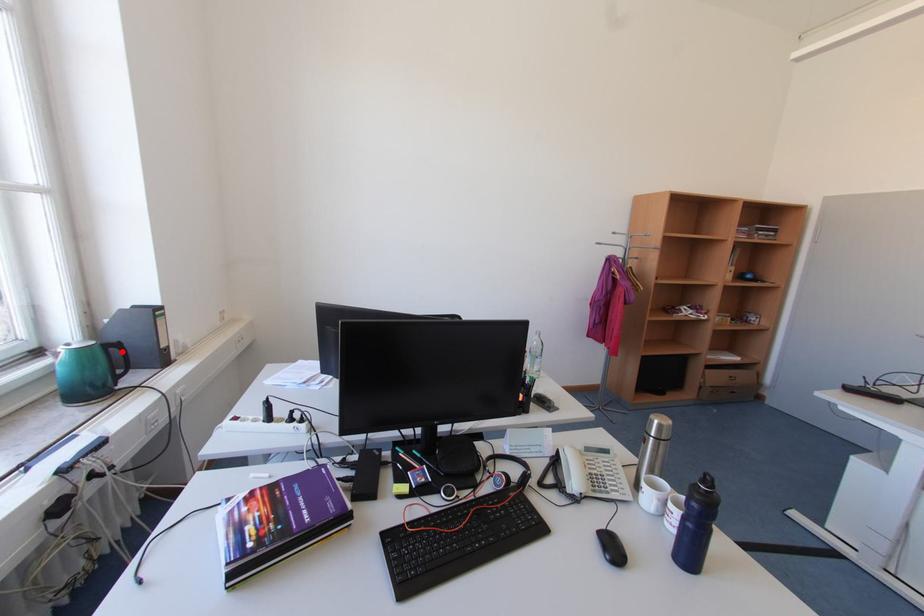
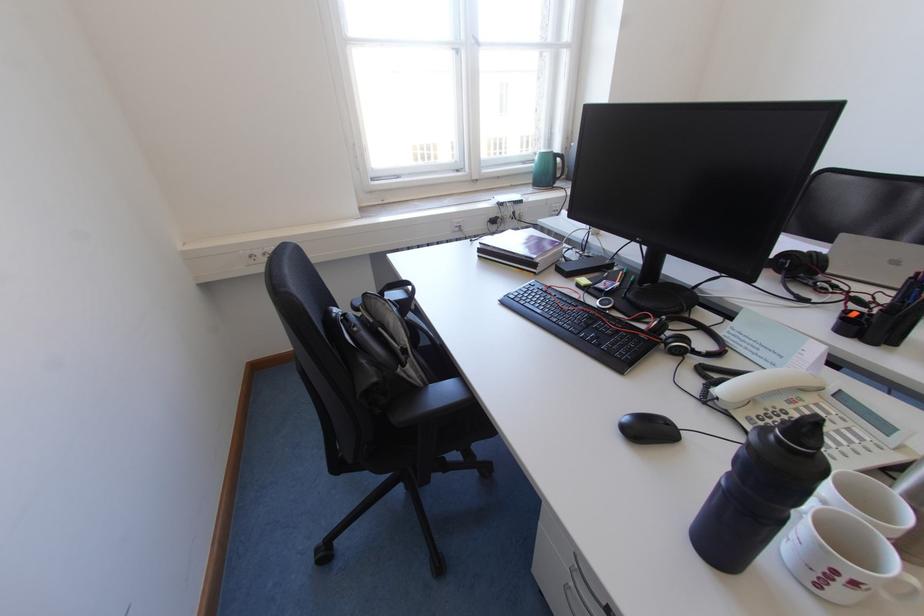
The point at the highlighted location is marked in the first image. Where is the corresponding point in the second image?

(566, 161)